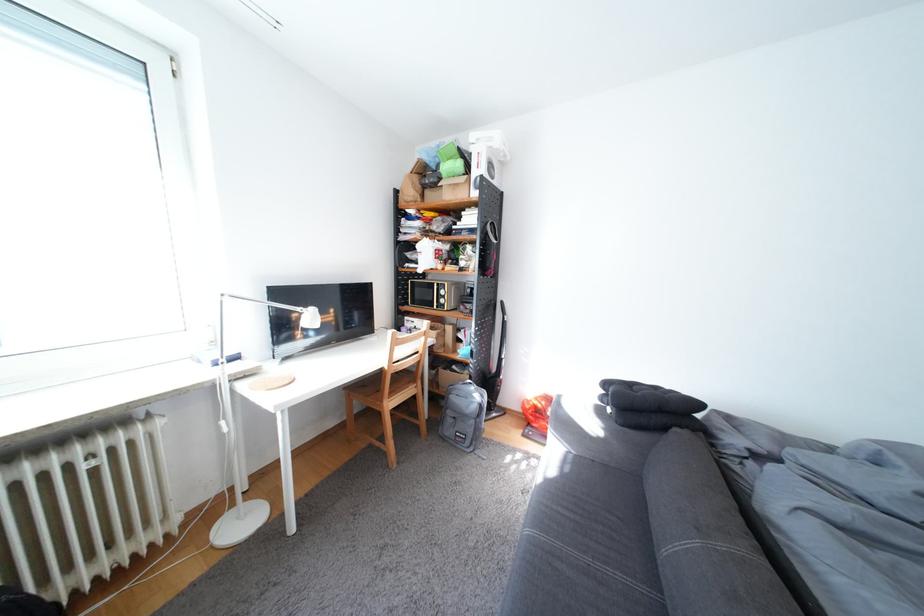
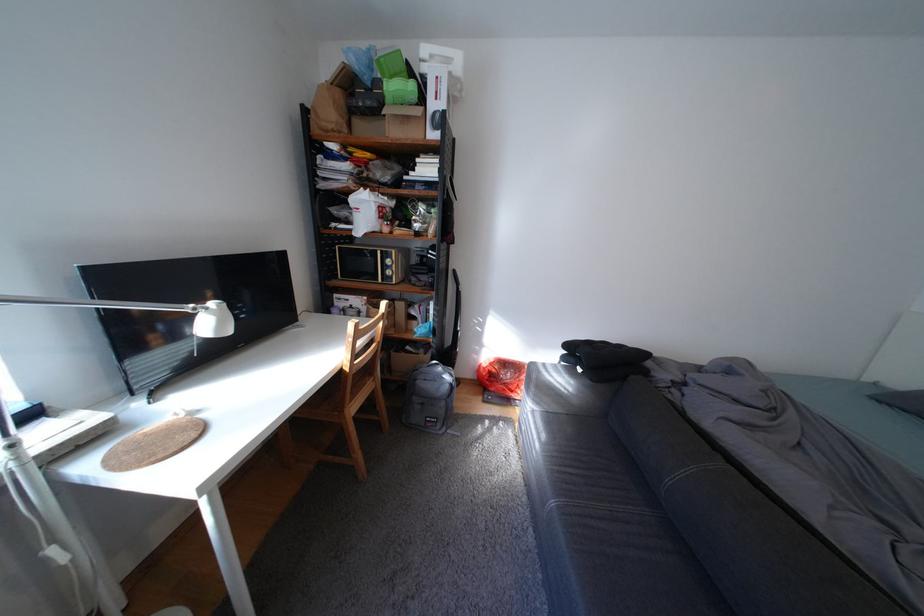
In the second image, find the point that corresponds to [454,179] in the first image.

(395, 103)